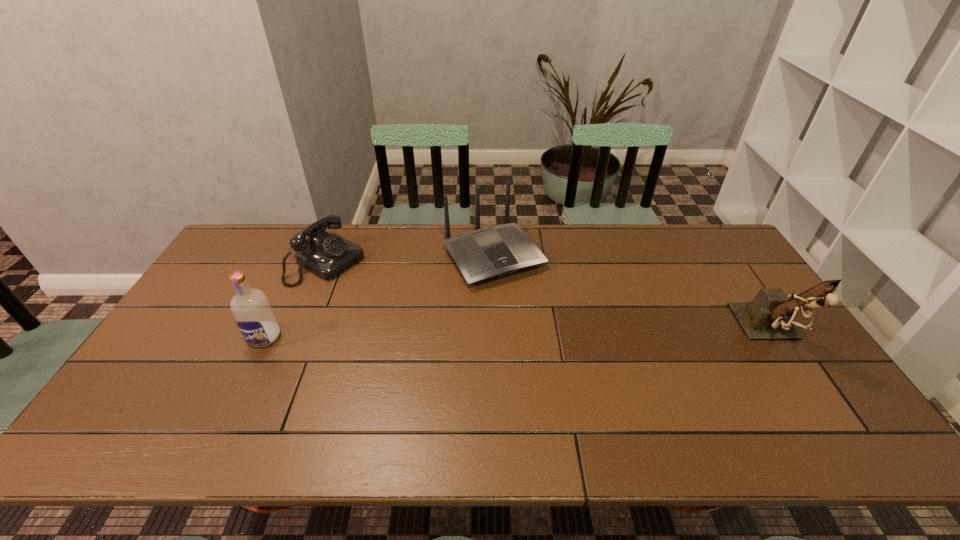
The height and width of the screenshot is (540, 960). I want to click on vacant region located on the front-facing side of the second object from right to left, so click(x=553, y=338).

This screenshot has height=540, width=960. I want to click on free location located on the front-facing side of the second object from right to left, so click(538, 316).

Where is `vacant space located 0.180m on the front-facing side of the second object from right to left`? vacant space located 0.180m on the front-facing side of the second object from right to left is located at coordinates (546, 328).

Identify the location of telephone at the far edge. (327, 255).

This screenshot has width=960, height=540. I want to click on router at the far edge, so click(497, 251).

Identify the location of object that is at the right edge. The height and width of the screenshot is (540, 960). (769, 316).

Identify the location of vacant space at the far edge of the desktop. (424, 248).

The height and width of the screenshot is (540, 960). I want to click on vacant space at the near edge of the desktop, so [263, 404].

You are a GUI agent. You are given a task and a screenshot of the screen. Output one action in this format:
    pyautogui.click(x=<x>, y=<y>)
    Task: Click on the free location at the right edge
    This screenshot has height=540, width=960.
    Given the screenshot: What is the action you would take?
    pyautogui.click(x=774, y=354)

You are a GUI agent. You are given a task and a screenshot of the screen. Output one action in this format:
    pyautogui.click(x=<x>, y=<y>)
    Task: Click on the free space at the near left corner of the desktop
    This screenshot has height=540, width=960.
    Given the screenshot: What is the action you would take?
    pyautogui.click(x=175, y=383)